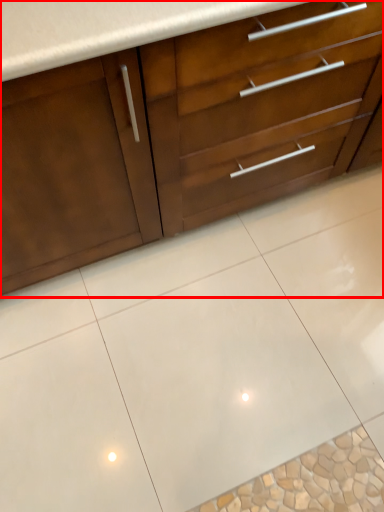
Question: From the image's perspective, where is cabinetry (annotated by the red box) located in relation to ceramic tile in the image?

Choices:
 (A) below
 (B) above

Answer: (B)